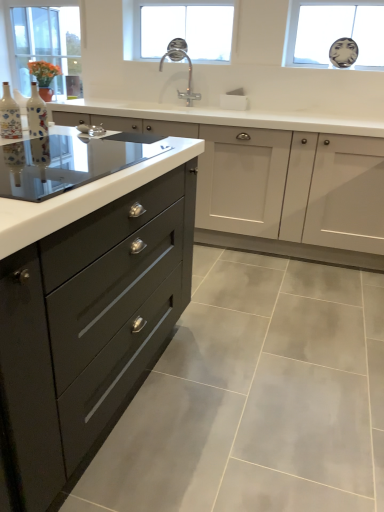
What do you see at coordinates (36, 114) in the screenshot? The width and height of the screenshot is (384, 512). I see `decorative ceramic vase at left, which is the second bottle in left-to-right order` at bounding box center [36, 114].

Locate an element on the screen. This screenshot has width=384, height=512. matte black drawer at left is located at coordinates (88, 327).

Locate an element on the screen. This screenshot has height=512, width=384. clear glass faucet at upper center, the 2th window viewed from the right is located at coordinates (177, 29).

I want to click on transparent glass mirror at upper right, which appears as the 1th window when viewed from the right, so click(334, 32).

From the picture: How much space does clear glass window at upper left, which appears as the first window when viewed from the left, occupy vertically?

The height of clear glass window at upper left, which appears as the first window when viewed from the left, is 32.51 inches.

From the picture: Measure the distance between clear glass window at upper left, which appears as the first window when viewed from the left, and camera.

A distance of 3.36 meters exists between clear glass window at upper left, which appears as the first window when viewed from the left, and camera.

Find the location of a particular element. matte ceramic vase at left, positioned as the 2th bottle in right-to-left order is located at coordinates (9, 115).

Would you say matte black drawer at left is part of transparent glass mirror at upper right, acting as the 3th window starting from the left,'s contents?

That's incorrect, matte black drawer at left is not inside transparent glass mirror at upper right, acting as the 3th window starting from the left.

Considering the relative sizes of transparent glass mirror at upper right, which appears as the 1th window when viewed from the right, and matte black drawer at left in the image provided, is transparent glass mirror at upper right, which appears as the 1th window when viewed from the right, smaller than matte black drawer at left?

Yes, transparent glass mirror at upper right, which appears as the 1th window when viewed from the right, is smaller than matte black drawer at left.

From the picture: Who is more distant, transparent glass mirror at upper right, which appears as the 1th window when viewed from the right, or matte black drawer at left?

transparent glass mirror at upper right, which appears as the 1th window when viewed from the right.

Is transparent glass mirror at upper right, acting as the 3th window starting from the left, far from matte black drawer at left?

Yes, transparent glass mirror at upper right, acting as the 3th window starting from the left, and matte black drawer at left are quite far apart.

From the image's perspective, between black glass cooktop at left and clear glass window at upper left, which appears as the first window when viewed from the left, which one is located above?

clear glass window at upper left, which appears as the first window when viewed from the left, appears higher in the image.

Is black glass cooktop at left turned away from clear glass window at upper left, which appears as the first window when viewed from the left?

That's not correct — black glass cooktop at left is not looking away from clear glass window at upper left, which appears as the first window when viewed from the left.

Is black glass cooktop at left bigger than clear glass window at upper left, which appears as the first window when viewed from the left?

Actually, black glass cooktop at left might be smaller than clear glass window at upper left, which appears as the first window when viewed from the left.

Considering the relative sizes of clear glass window at upper left, the 3th window in the right-to-left sequence, and matte black drawer at left in the image provided, is clear glass window at upper left, the 3th window in the right-to-left sequence, taller than matte black drawer at left?

Incorrect, the height of clear glass window at upper left, the 3th window in the right-to-left sequence, is not larger of that of matte black drawer at left.

Which object is closer to the camera taking this photo, clear glass window at upper left, which appears as the first window when viewed from the left, or matte black drawer at left?

matte black drawer at left is in front.

Is clear glass window at upper left, which appears as the first window when viewed from the left, aimed at matte black drawer at left?

No, clear glass window at upper left, which appears as the first window when viewed from the left, is not oriented towards matte black drawer at left.

Measure the distance from clear glass window at upper left, the 3th window in the right-to-left sequence, to matte black drawer at left.

clear glass window at upper left, the 3th window in the right-to-left sequence, and matte black drawer at left are 2.74 meters apart.

Considering the sizes of polished chrome faucet at center and clear glass faucet at upper center, the second window viewed from the left, in the image, is polished chrome faucet at center taller or shorter than clear glass faucet at upper center, the second window viewed from the left,?

Considering their sizes, polished chrome faucet at center has less height than clear glass faucet at upper center, the second window viewed from the left.

From a real-world perspective, which is physically above, polished chrome faucet at center or clear glass faucet at upper center, the 2th window viewed from the right?

clear glass faucet at upper center, the 2th window viewed from the right, from a real-world perspective.

At what (x,y) coordinates should I click in order to perform the action: click on sink lying on the left of clear glass faucet at upper center, the second window viewed from the left. Please return your answer as a coordinate pair (x, y). This screenshot has width=384, height=512. Looking at the image, I should click on (188, 77).

Are polished chrome faucet at center and clear glass faucet at upper center, the 2th window viewed from the right, located far from each other?

No, polished chrome faucet at center is not far away from clear glass faucet at upper center, the 2th window viewed from the right.

Does point (44, 118) lie behind point (178, 33)?

No, (44, 118) is in front of (178, 33).

Considering the relative positions of decorative ceramic vase at left, the 1th bottle from the right, and clear glass faucet at upper center, the second window viewed from the left, in the image provided, is decorative ceramic vase at left, the 1th bottle from the right, to the left of clear glass faucet at upper center, the second window viewed from the left, from the viewer's perspective?

Correct, you'll find decorative ceramic vase at left, the 1th bottle from the right, to the left of clear glass faucet at upper center, the second window viewed from the left.

Is decorative ceramic vase at left, the 1th bottle from the right, shorter than clear glass faucet at upper center, the 2th window viewed from the right?

Yes.

From the image's perspective, is decorative ceramic vase at left, which is the second bottle in left-to-right order, located beneath clear glass faucet at upper center, the 2th window viewed from the right?

Indeed, from the image's perspective, decorative ceramic vase at left, which is the second bottle in left-to-right order, is shown beneath clear glass faucet at upper center, the 2th window viewed from the right.

Considering the sizes of objects matte black drawer at left and matte ceramic vase at left, which appears as the 1th bottle when viewed from the left, in the image provided, who is taller, matte black drawer at left or matte ceramic vase at left, which appears as the 1th bottle when viewed from the left,?

With more height is matte black drawer at left.

Looking at this image, between matte black drawer at left and matte ceramic vase at left, positioned as the 2th bottle in right-to-left order, which one is positioned in front?

matte ceramic vase at left, positioned as the 2th bottle in right-to-left order, is closer to the camera.

Does point (253, 175) appear closer or farther from the camera than point (7, 98)?

Point (253, 175).

Where is `cabinetry that appears behind the matte ceramic vase at left, which appears as the 1th bottle when viewed from the left`? cabinetry that appears behind the matte ceramic vase at left, which appears as the 1th bottle when viewed from the left is located at coordinates (276, 189).

Is matte ceramic vase at left, which appears as the 1th bottle when viewed from the left, turned away from matte black drawer at left?

No, matte ceramic vase at left, which appears as the 1th bottle when viewed from the left, is not facing away from matte black drawer at left.

Which object is further away from the camera, matte ceramic vase at left, which appears as the 1th bottle when viewed from the left, or matte black drawer at left?

matte ceramic vase at left, which appears as the 1th bottle when viewed from the left.

Is point (12, 105) closer or farther from the camera than point (79, 439)?

Point (12, 105) is farther from the camera than point (79, 439).

Where is `drawer on the left of transparent glass mirror at upper right, which appears as the 1th window when viewed from the right`? Image resolution: width=384 pixels, height=512 pixels. drawer on the left of transparent glass mirror at upper right, which appears as the 1th window when viewed from the right is located at coordinates (88, 327).

The image size is (384, 512). Find the location of `home appliance below the clear glass window at upper left, which appears as the first window when viewed from the left (from a real-world perspective)`. home appliance below the clear glass window at upper left, which appears as the first window when viewed from the left (from a real-world perspective) is located at coordinates (69, 161).

From the image, which object appears to be farther from polished chrome faucet at center, clear glass faucet at upper center, the 2th window viewed from the right, or matte black drawer at left?

Based on the image, matte black drawer at left appears to be further to polished chrome faucet at center.

From the image, which object appears to be farther from decorative ceramic vase at left, which is the second bottle in left-to-right order, clear glass window at upper left, the 3th window in the right-to-left sequence, or transparent glass mirror at upper right, acting as the 3th window starting from the left?

Based on the image, clear glass window at upper left, the 3th window in the right-to-left sequence, appears to be further to decorative ceramic vase at left, which is the second bottle in left-to-right order.

Based on their spatial positions, is clear glass faucet at upper center, the 2th window viewed from the right, or polished chrome faucet at center further from matte ceramic vase at left, which appears as the 1th bottle when viewed from the left?

clear glass faucet at upper center, the 2th window viewed from the right, lies further to matte ceramic vase at left, which appears as the 1th bottle when viewed from the left, than the other object.

From the image, which object appears to be nearer to polished chrome faucet at center, matte black drawer at left or matte black drawer at left?

matte black drawer at left.

Estimate the real-world distances between objects in this image. Which object is closer to matte black drawer at left, clear glass faucet at upper center, the second window viewed from the left, or matte ceramic vase at left, which appears as the 1th bottle when viewed from the left?

clear glass faucet at upper center, the second window viewed from the left, is closer to matte black drawer at left.

Estimate the real-world distances between objects in this image. Which object is closer to matte black drawer at left, matte ceramic vase at left, which appears as the 1th bottle when viewed from the left, or black glass cooktop at left?

black glass cooktop at left is positioned closer to the anchor matte black drawer at left.

When comparing their distances from clear glass window at upper left, the 3th window in the right-to-left sequence, does matte black drawer at left or decorative ceramic vase at left, which is the second bottle in left-to-right order, seem further?

Among the two, matte black drawer at left is located further to clear glass window at upper left, the 3th window in the right-to-left sequence.

Looking at the image, which one is located further to black glass cooktop at left, matte black drawer at left or polished chrome faucet at center?

polished chrome faucet at center lies further to black glass cooktop at left than the other object.

This screenshot has height=512, width=384. I want to click on cabinetry between matte black drawer at left and polished chrome faucet at center along the z-axis, so click(x=276, y=189).

In order to click on bottle between matte ceramic vase at left, positioned as the 2th bottle in right-to-left order, and transparent glass mirror at upper right, acting as the 3th window starting from the left, from left to right in this screenshot , I will do `click(36, 114)`.

Where is `window between clear glass window at upper left, which appears as the first window when viewed from the left, and matte black drawer at left, in the horizontal direction`? This screenshot has width=384, height=512. window between clear glass window at upper left, which appears as the first window when viewed from the left, and matte black drawer at left, in the horizontal direction is located at coordinates (177, 29).

I want to click on sink between matte black drawer at left and clear glass window at upper left, the 3th window in the right-to-left sequence, along the z-axis, so click(x=188, y=77).